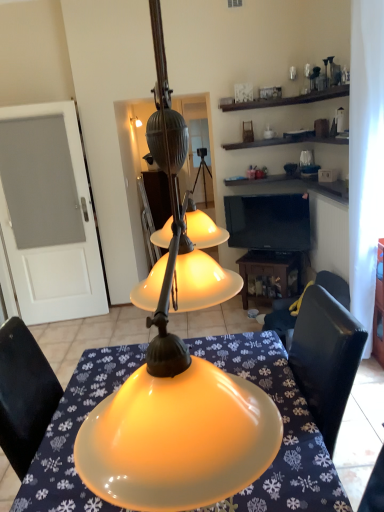
Question: Considering the relative sizes of black leather chair at lower right and matte yellow glass lampshade at center in the image provided, is black leather chair at lower right taller than matte yellow glass lampshade at center?

Choices:
 (A) no
 (B) yes

Answer: (A)

Question: Does black leather chair at lower right contain matte yellow glass lampshade at center?

Choices:
 (A) yes
 (B) no

Answer: (B)

Question: Can you confirm if black leather chair at lower right is wider than matte yellow glass lampshade at center?

Choices:
 (A) no
 (B) yes

Answer: (B)

Question: Can you confirm if black leather chair at lower right is shorter than matte yellow glass lampshade at center?

Choices:
 (A) yes
 (B) no

Answer: (A)

Question: Could you tell me if black leather chair at lower right is turned towards matte yellow glass lampshade at center?

Choices:
 (A) no
 (B) yes

Answer: (A)

Question: From the image's perspective, is black leather chair at lower right below matte yellow glass lampshade at center?

Choices:
 (A) no
 (B) yes

Answer: (B)

Question: Is matte yellow glass lampshade at center bigger than black glossy tv at upper right?

Choices:
 (A) yes
 (B) no

Answer: (A)

Question: From the image's perspective, would you say matte yellow glass lampshade at center is shown under black glossy tv at upper right?

Choices:
 (A) no
 (B) yes

Answer: (A)

Question: Can you confirm if matte yellow glass lampshade at center is positioned to the right of black glossy tv at upper right?

Choices:
 (A) yes
 (B) no

Answer: (B)

Question: Does matte yellow glass lampshade at center have a greater width compared to black glossy tv at upper right?

Choices:
 (A) no
 (B) yes

Answer: (B)

Question: From a real-world perspective, is matte yellow glass lampshade at center positioned under black glossy tv at upper right based on gravity?

Choices:
 (A) no
 (B) yes

Answer: (A)

Question: Is the position of matte yellow glass lampshade at center more distant than that of black glossy tv at upper right?

Choices:
 (A) no
 (B) yes

Answer: (A)

Question: Considering the relative sizes of matte yellow lampshade at center and wooden table at lower center in the image provided, is matte yellow lampshade at center thinner than wooden table at lower center?

Choices:
 (A) no
 (B) yes

Answer: (A)